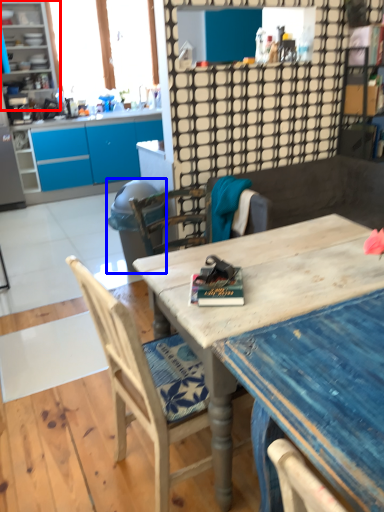
Question: Which point is further to the camera, cabinetry (highlighted by a red box) or trash bin/can (highlighted by a blue box)?

Choices:
 (A) cabinetry
 (B) trash bin/can

Answer: (A)